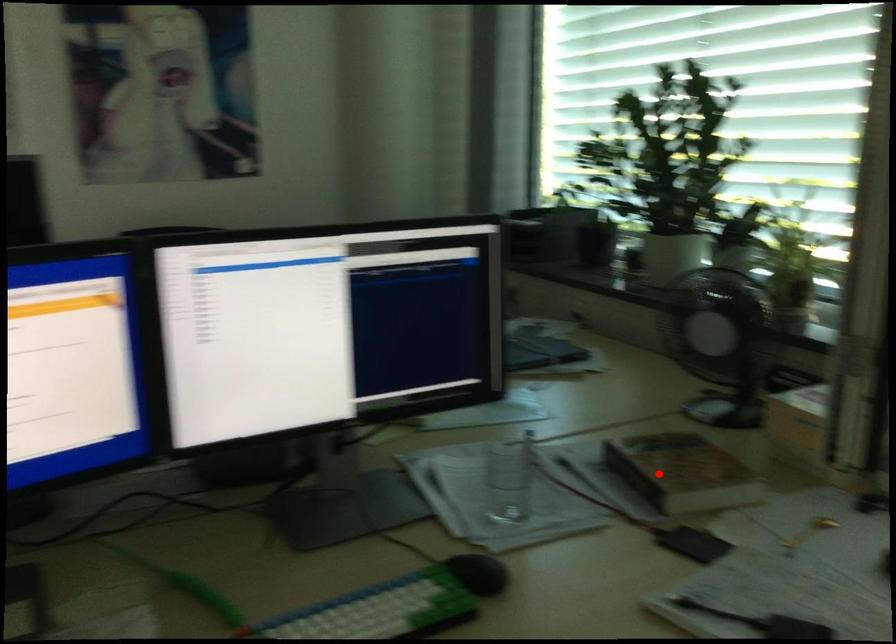
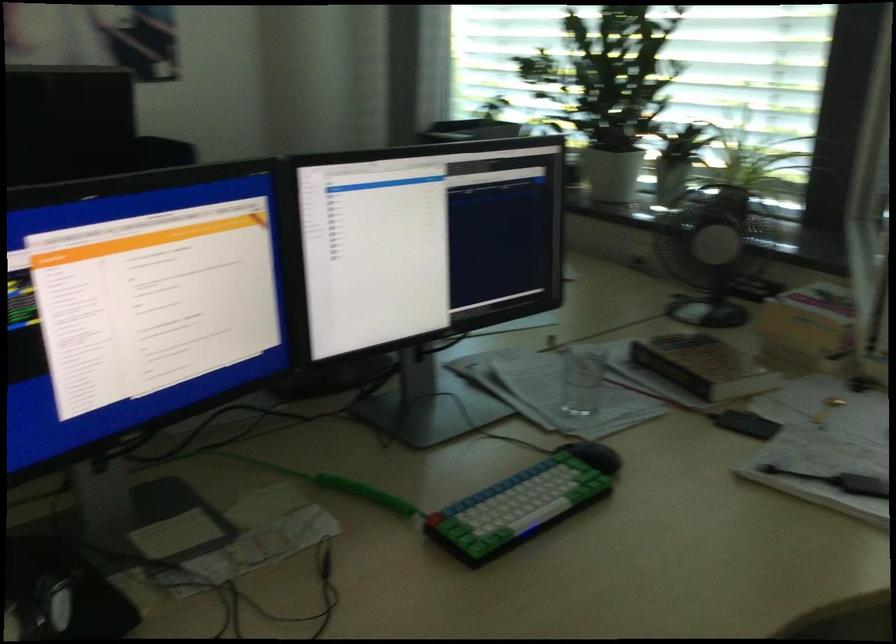
The point at the highlighted location is marked in the first image. Where is the corresponding point in the second image?

(703, 366)